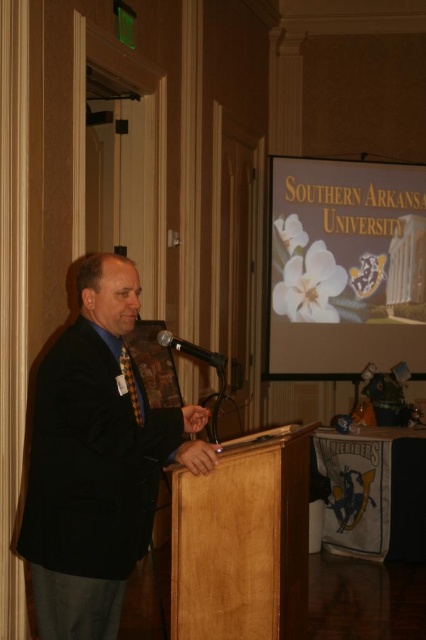
Is white matte flower at upper center below multicolored woven tie at center?

Actually, white matte flower at upper center is above multicolored woven tie at center.

Can you confirm if white matte flower at upper center is thinner than multicolored woven tie at center?

No, white matte flower at upper center is not thinner than multicolored woven tie at center.

Who is more distant from viewer, (348, 163) or (126, 365)?

The point (348, 163) is behind.

Locate an element on the screen. white matte flower at upper center is located at coordinates (345, 268).

Can you confirm if black textured suit at center is bigger than black metallic microphone at center?

Yes.

Image resolution: width=426 pixels, height=640 pixels. In order to click on black textured suit at center in this screenshot , I will do `click(95, 461)`.

The image size is (426, 640). What are the coordinates of `black textured suit at center` in the screenshot? It's located at [x=95, y=461].

Does point (259, 602) come closer to viewer compared to point (129, 369)?

No, it is behind (129, 369).

In order to click on wooden podium at center in this screenshot , I will do `click(242, 540)`.

Locate an element on the screen. wooden podium at center is located at coordinates (242, 540).